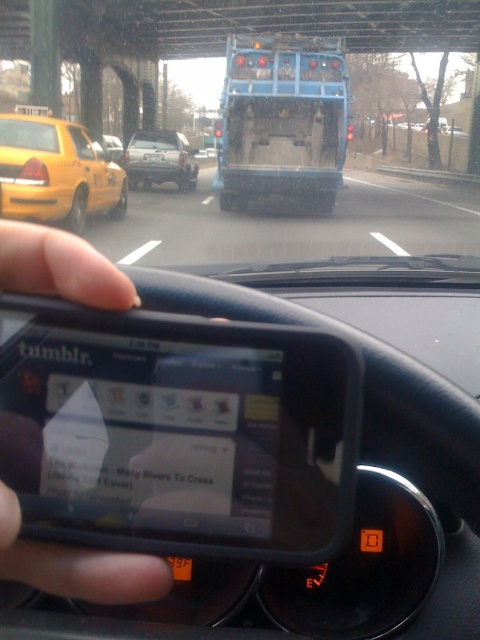
Question: Which of the following is the farthest from the observer?

Choices:
 (A) yellow matte taxi at left
 (B) yellow matte taxi cab at left
 (C) matte silver truck at center
 (D) black matte phone at center

Answer: (C)

Question: Can you confirm if black matte phone at center is bigger than yellow matte taxi cab at left?

Choices:
 (A) no
 (B) yes

Answer: (A)

Question: Is yellow matte taxi at left closer to the viewer compared to matte silver truck at center?

Choices:
 (A) no
 (B) yes

Answer: (B)

Question: Does matte silver truck at center have a greater width compared to yellow matte taxi cab at left?

Choices:
 (A) no
 (B) yes

Answer: (A)

Question: Which point is farther from the camera taking this photo?

Choices:
 (A) (140, 156)
 (B) (119, 141)
 (C) (15, 209)

Answer: (B)

Question: Which object is the closest to the black matte phone at center?

Choices:
 (A) yellow matte taxi cab at left
 (B) matte silver truck at center
 (C) yellow matte taxi at left

Answer: (C)